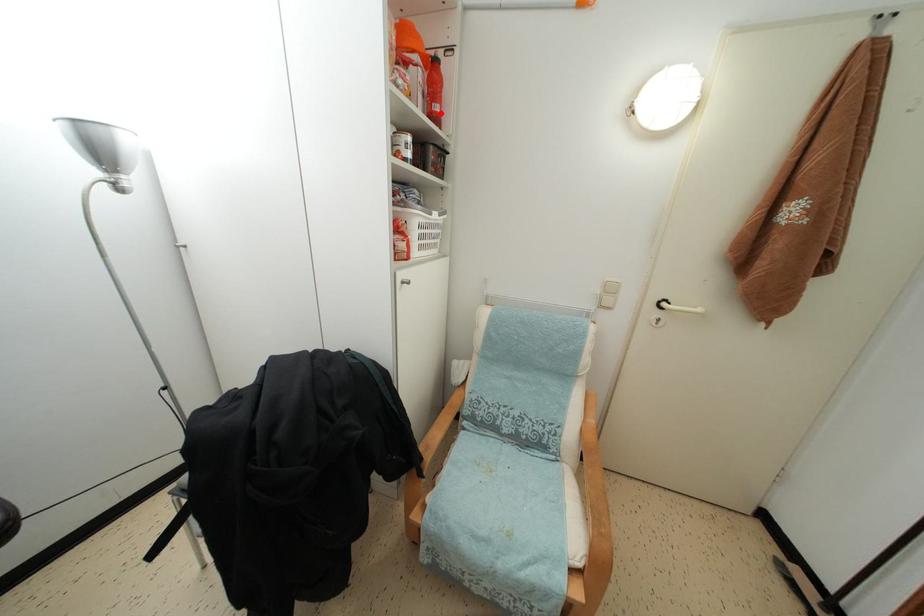
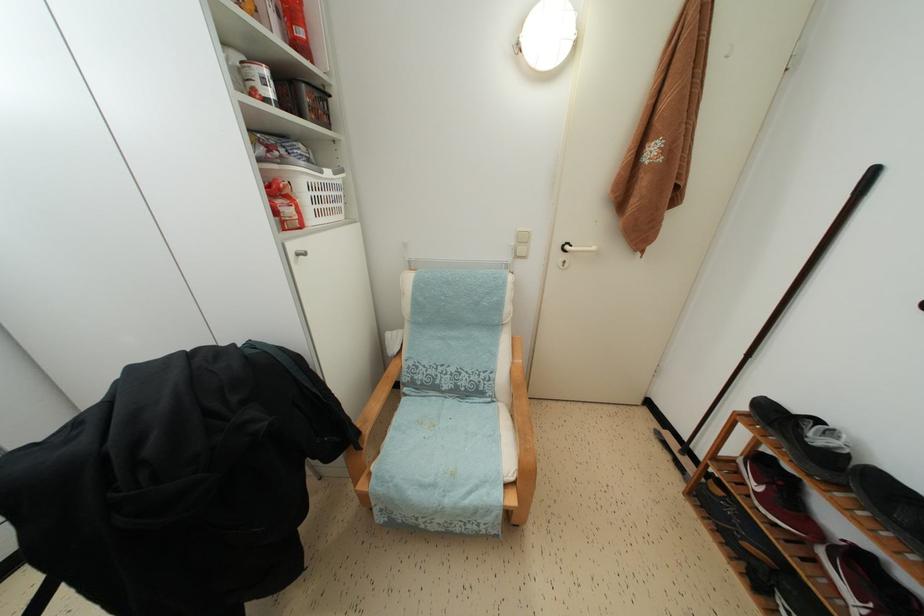
Question: I am providing you with two images of the same scene from different viewpoints. A red point is marked on the first image. At the location where the point appears in image 1, is it still visible in image 2?

Choices:
 (A) Yes
 (B) No

Answer: (A)